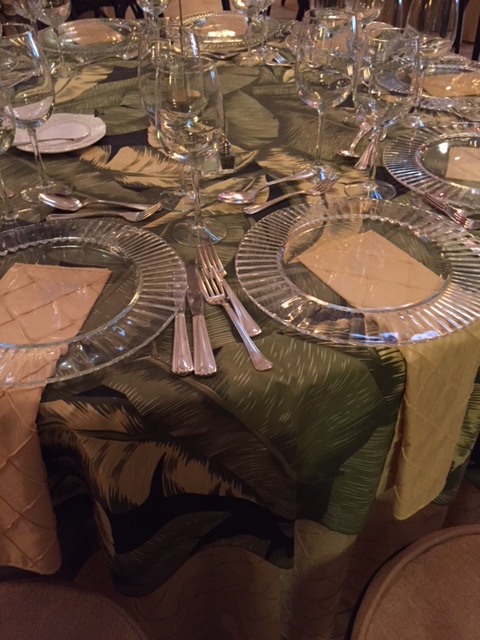
Where is `cloth napkin`? This screenshot has height=640, width=480. cloth napkin is located at coordinates (448, 369), (15, 428), (461, 161), (451, 84), (94, 34), (224, 28), (339, 45).